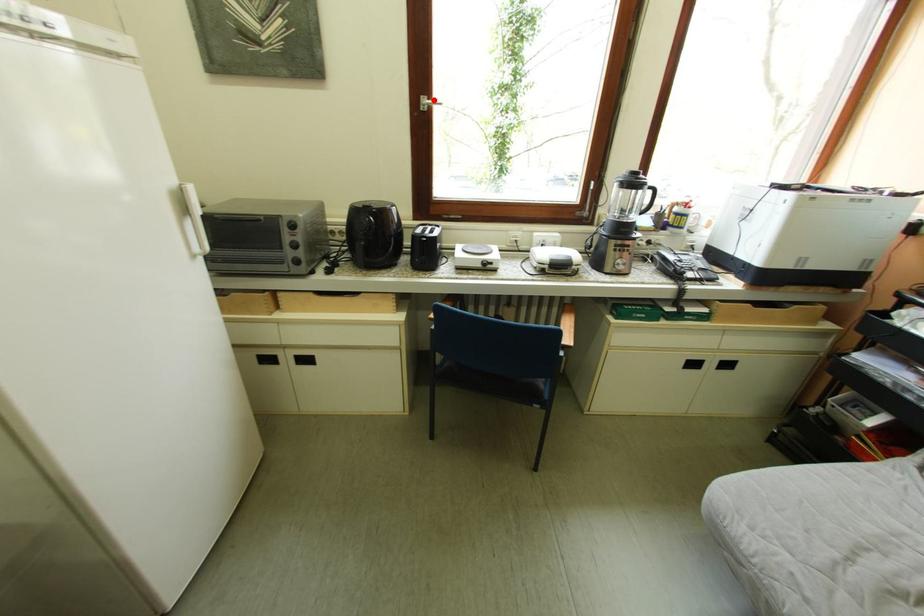
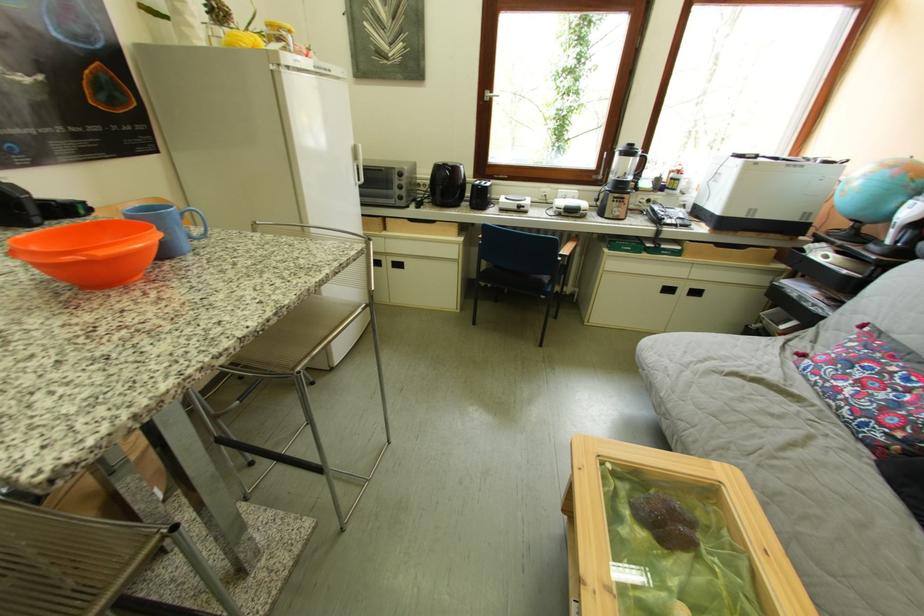
In the second image, find the point that corresponds to the highlighted location in the first image.

(497, 94)